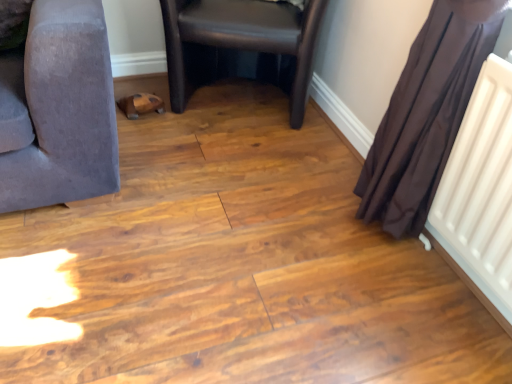
Question: Does brown sheer curtain at right have a lesser width compared to black leather chair at center?

Choices:
 (A) no
 (B) yes

Answer: (B)

Question: Can you confirm if brown sheer curtain at right is positioned to the left of black leather chair at center?

Choices:
 (A) yes
 (B) no

Answer: (B)

Question: Is brown sheer curtain at right far away from black leather chair at center?

Choices:
 (A) no
 (B) yes

Answer: (A)

Question: Is brown sheer curtain at right bigger than black leather chair at center?

Choices:
 (A) yes
 (B) no

Answer: (B)

Question: Is brown sheer curtain at right taller than black leather chair at center?

Choices:
 (A) no
 (B) yes

Answer: (B)

Question: From the image's perspective, is brown sheer curtain at right above black leather chair at center?

Choices:
 (A) no
 (B) yes

Answer: (A)

Question: From the image's perspective, is black leather chair at center located above brown sheer curtain at right?

Choices:
 (A) no
 (B) yes

Answer: (B)

Question: Can you confirm if black leather chair at center is bigger than brown sheer curtain at right?

Choices:
 (A) yes
 (B) no

Answer: (A)

Question: Is black leather chair at center to the left of brown sheer curtain at right from the viewer's perspective?

Choices:
 (A) yes
 (B) no

Answer: (A)

Question: From the image's perspective, does black leather chair at center appear lower than brown sheer curtain at right?

Choices:
 (A) no
 (B) yes

Answer: (A)

Question: From a real-world perspective, is black leather chair at center beneath brown sheer curtain at right?

Choices:
 (A) no
 (B) yes

Answer: (B)

Question: Is the depth of black leather chair at center greater than that of brown sheer curtain at right?

Choices:
 (A) yes
 (B) no

Answer: (A)

Question: In terms of height, does brown sheer curtain at right look taller or shorter compared to black leather chair at center?

Choices:
 (A) short
 (B) tall

Answer: (B)